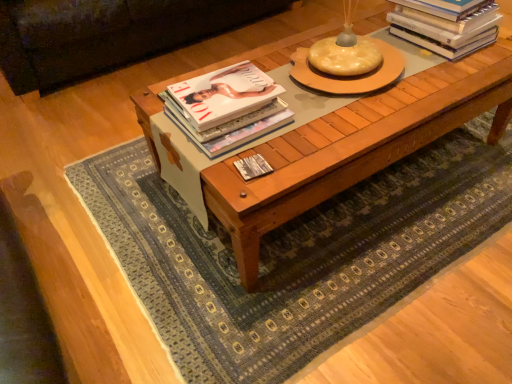
Locate an element on the screen. This screenshot has height=384, width=512. free space in front of matte hardcover book at center, the second book from the bottom is located at coordinates (247, 167).